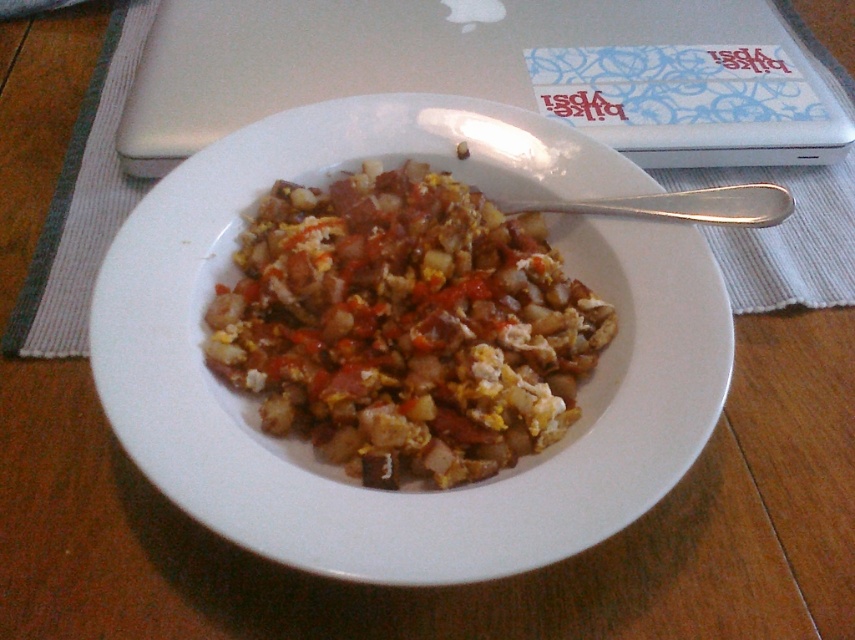
Looking at this image, you are trying to locate the point with coordinates (433, 68) on the image. Based on the scene description, where would this point be located?

The point is located on the silver metallic laptop at upper center.

You are a student who just finished eating the scrambled eggs and want to move your silver metallic laptop at upper center to the white fabric placemat at center. Can you place the laptop directly on the placemat without moving anything else?

The white fabric placemat at center is behind the silver metallic laptop at upper center, so the laptop is already placed on the placemat. You don not need to move it.